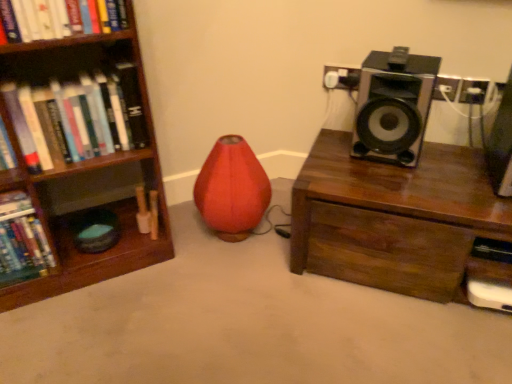
This screenshot has width=512, height=384. Identify the location of free space in front of black plastic speaker at upper right, which ranks as the 1th speaker in left-to-right order. (415, 183).